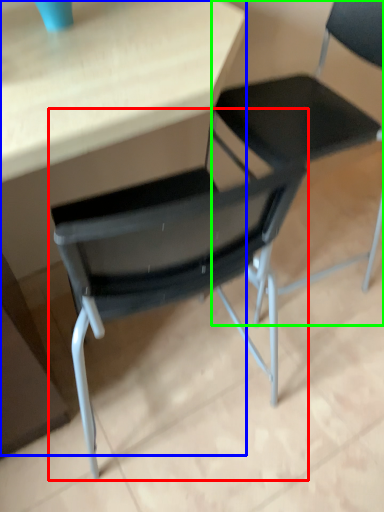
Question: Which object is positioned closest to chair (highlighted by a red box)? Select from table (highlighted by a blue box) and chair (highlighted by a green box).

Choices:
 (A) table
 (B) chair

Answer: (A)